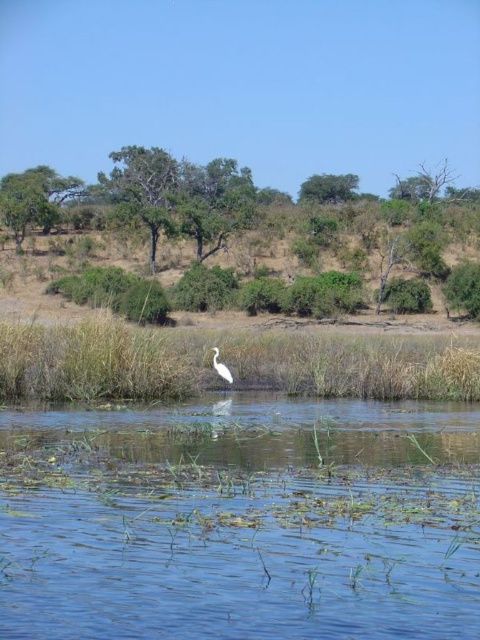
Question: Can you confirm if green leafy tree at upper center is positioned below white glossy bird at center?

Choices:
 (A) yes
 (B) no

Answer: (B)

Question: Which point is closer to the camera?

Choices:
 (A) green leafy tree at upper left
 (B) green grass at lower center

Answer: (B)

Question: Is clear blue water at center above green leafy tree at upper left?

Choices:
 (A) yes
 (B) no

Answer: (B)

Question: Based on their relative distances, which object is nearer to the white glossy bird at center?

Choices:
 (A) green leafy tree at upper left
 (B) green grass at lower center
 (C) clear blue water at center

Answer: (B)

Question: Can you confirm if green grass at lower center is bigger than green leafy tree at upper center?

Choices:
 (A) yes
 (B) no

Answer: (B)

Question: Which is farther from the white glossy bird at center?

Choices:
 (A) green grass at lower center
 (B) green leafy tree at upper left
 (C) clear blue water at center

Answer: (B)